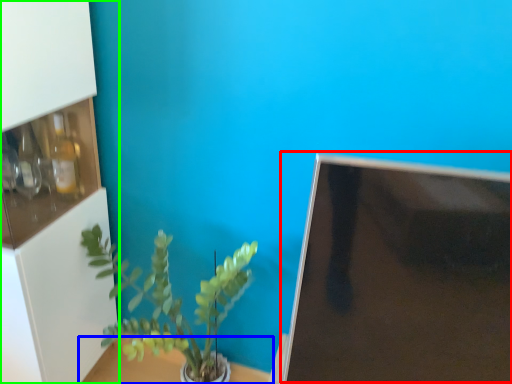
Question: Based on their relative distances, which object is farther from computer monitor (highlighted by a red box)? Choose from table (highlighted by a blue box) and shelf (highlighted by a green box).

Choices:
 (A) table
 (B) shelf

Answer: (A)